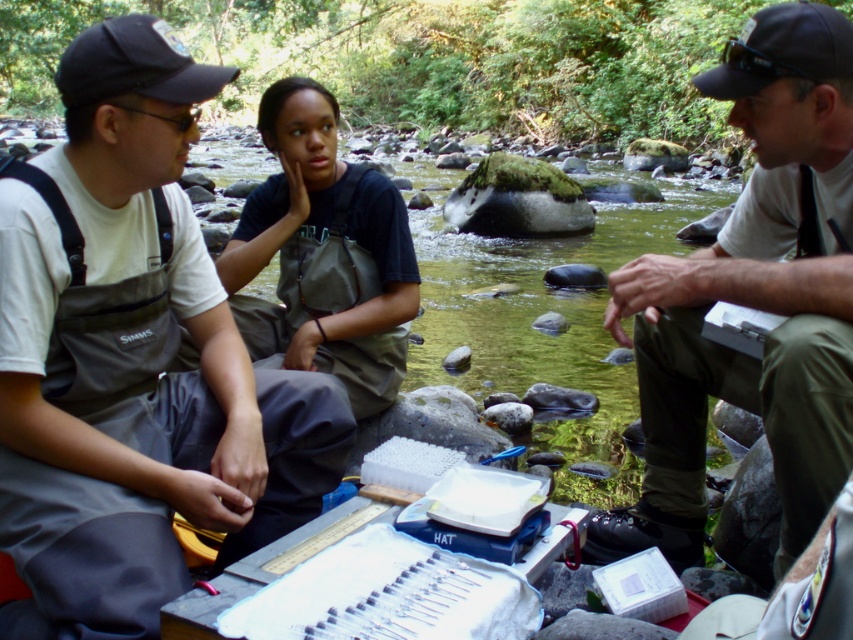
Does gray fabric waders at left appear under black fabric baseball cap at upper left?

Correct, gray fabric waders at left is located below black fabric baseball cap at upper left.

What do you see at coordinates (132, 358) in the screenshot? I see `gray fabric waders at left` at bounding box center [132, 358].

Is point (114, 192) in front of point (96, 76)?

No.

At what (x,y) coordinates should I click in order to perform the action: click on gray fabric waders at left. Please return your answer as a coordinate pair (x, y). This screenshot has width=853, height=640. Looking at the image, I should click on (132, 358).

Does gray fabric waders at left appear on the left side of matte white shirt at center?

Yes, gray fabric waders at left is to the left of matte white shirt at center.

Does gray fabric waders at left have a smaller size compared to matte white shirt at center?

Yes, gray fabric waders at left is smaller than matte white shirt at center.

Who is more distant from viewer, (164,196) or (834,163)?

The point (164,196) is more distant.

This screenshot has width=853, height=640. Find the location of `gray fabric waders at left`. gray fabric waders at left is located at coordinates (132, 358).

Between point (775, 371) and point (358, 243), which one is positioned in front?

Point (775, 371)

Does matte white shirt at center have a greater height compared to dark gray waders at center?

Yes.

Describe the element at coordinates (752, 298) in the screenshot. The height and width of the screenshot is (640, 853). I see `matte white shirt at center` at that location.

Identify the location of matte white shirt at center. (752, 298).